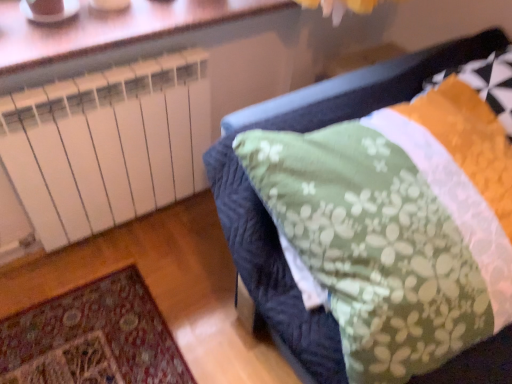
You are a GUI agent. You are given a task and a screenshot of the screen. Output one action in this format:
    pyautogui.click(x=<x>, y=<y>)
    Task: Click on the orange textured pillow at upper right
    The image size is (512, 384).
    Given the screenshot: What is the action you would take?
    pyautogui.click(x=485, y=83)

Measure the distance between point (x=192, y=18) and camera.

Point (x=192, y=18) and camera are 3.89 feet apart from each other.

Measure the distance between white plastic radiator at upper left and camera.

white plastic radiator at upper left and camera are 38.03 inches apart.

This screenshot has width=512, height=384. Identify the location of orange textured pillow at upper right. (485, 83).

Does point (490, 62) come closer to viewer compared to point (240, 229)?

No, (490, 62) is further to viewer.

From the image's perspective, is orange textured pillow at upper right on green floral fabric at center?

Correct, orange textured pillow at upper right appears higher than green floral fabric at center in the image.

From a real-world perspective, which is physically below, orange textured pillow at upper right or green floral fabric at center?

From a 3D spatial view, green floral fabric at center is below.

Which object is further away from the camera, orange textured pillow at upper right or green floral fabric at center?

orange textured pillow at upper right is further from the camera.

Can you tell me how much white plastic radiator at upper left and orange textured pillow at upper right differ in facing direction?

white plastic radiator at upper left and orange textured pillow at upper right are facing 4.6 degrees away from each other.

What are the coordinates of `window above the orange textured pillow at upper right (from a real-world perspective)` in the screenshot? It's located at (110, 27).

Which of these two, white plastic radiator at upper left or orange textured pillow at upper right, is smaller?

white plastic radiator at upper left is smaller.

Is white plastic radiator at upper left positioned with its back to orange textured pillow at upper right?

That's not correct — white plastic radiator at upper left is not looking away from orange textured pillow at upper right.

Is green floral fabric at center oriented towards orange textured pillow at upper right?

Yes, green floral fabric at center is facing orange textured pillow at upper right.

Consider the image. Does green floral fabric at center have a lesser height compared to orange textured pillow at upper right?

No.

Image resolution: width=512 pixels, height=384 pixels. In order to click on furniture below the orange textured pillow at upper right (from a real-world perspective) in this screenshot , I will do `click(271, 270)`.

Is point (327, 343) closer to viewer compared to point (86, 44)?

Yes, it is in front of point (86, 44).

How much distance is there between green floral fabric at center and white plastic radiator at upper left?

green floral fabric at center is 21.73 inches from white plastic radiator at upper left.

How many degrees apart are the facing directions of green floral fabric at center and white plastic radiator at upper left?

They differ by 2.05 degrees in their facing directions.

Is white plastic radiator at upper left located within green floral fabric at center?

No, white plastic radiator at upper left is not a part of green floral fabric at center.

Considering the sizes of orange textured pillow at upper right and white plastic radiator at upper left in the image, is orange textured pillow at upper right bigger or smaller than white plastic radiator at upper left?

Considering their sizes, orange textured pillow at upper right takes up more space than white plastic radiator at upper left.

Is orange textured pillow at upper right outside of white plastic radiator at upper left?

orange textured pillow at upper right is positioned outside white plastic radiator at upper left.

From a real-world perspective, which object stands above the other?

white plastic radiator at upper left is physically above.

From the image's perspective, is orange textured pillow at upper right under white plastic radiator at upper left?

Correct, orange textured pillow at upper right appears lower than white plastic radiator at upper left in the image.

Which of these two, white plastic radiator at upper left or green floral fabric at center, is thinner?

Thinner between the two is white plastic radiator at upper left.

From the image's perspective, would you say white plastic radiator at upper left is shown under green floral fabric at center?

Actually, white plastic radiator at upper left appears above green floral fabric at center in the image.

Which object is closer to the camera, white plastic radiator at upper left or green floral fabric at center?

green floral fabric at center is in front.

Can you confirm if white plastic radiator at upper left is positioned to the left of green floral fabric at center?

Correct, you'll find white plastic radiator at upper left to the left of green floral fabric at center.

Image resolution: width=512 pixels, height=384 pixels. There is a green floral fabric at center. In order to click on pillow above it (from a real-world perspective) in this screenshot , I will do `click(485, 83)`.

I want to click on window on the left side of orange textured pillow at upper right, so click(x=110, y=27).

From the image, which object appears to be nearer to orange textured pillow at upper right, white plastic radiator at upper left or green floral fabric at center?

green floral fabric at center lies closer to orange textured pillow at upper right than the other object.

Estimate the real-world distances between objects in this image. Which object is further from orange textured pillow at upper right, green floral fabric at center or white plastic radiator at upper left?

white plastic radiator at upper left is positioned further to the anchor orange textured pillow at upper right.

Estimate the real-world distances between objects in this image. Which object is further from green floral fabric at center, white plastic radiator at upper left or orange textured pillow at upper right?

white plastic radiator at upper left.

From the image, which object appears to be farther from white plastic radiator at upper left, green floral fabric at center or orange textured pillow at upper right?

orange textured pillow at upper right is positioned further to the anchor white plastic radiator at upper left.

Based on the photo, from the image, which object appears to be nearer to white plastic radiator at upper left, orange textured pillow at upper right or green floral fabric at center?

Based on the image, green floral fabric at center appears to be nearer to white plastic radiator at upper left.

From the image, which object appears to be farther from green floral fabric at center, orange textured pillow at upper right or white plastic radiator at upper left?

white plastic radiator at upper left lies further to green floral fabric at center than the other object.

Where is `furniture between white plastic radiator at upper left and orange textured pillow at upper right in the horizontal direction`? furniture between white plastic radiator at upper left and orange textured pillow at upper right in the horizontal direction is located at coordinates (271, 270).